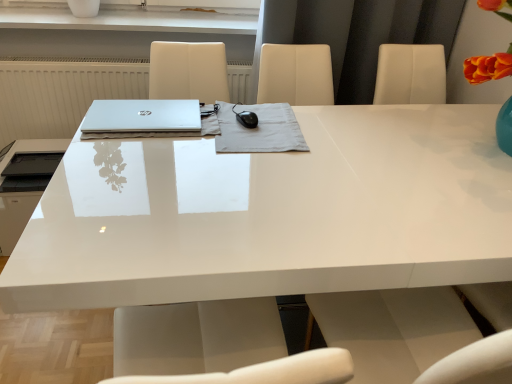
Question: Can you confirm if satin black mouse at center is wider than matte black printer at left?

Choices:
 (A) yes
 (B) no

Answer: (B)

Question: Is the position of satin black mouse at center more distant than that of matte black printer at left?

Choices:
 (A) no
 (B) yes

Answer: (A)

Question: Is satin black mouse at center aimed at matte black printer at left?

Choices:
 (A) no
 (B) yes

Answer: (A)

Question: Is satin black mouse at center closer to the viewer compared to matte black printer at left?

Choices:
 (A) yes
 (B) no

Answer: (A)

Question: Is satin black mouse at center looking in the opposite direction of matte black printer at left?

Choices:
 (A) yes
 (B) no

Answer: (B)

Question: Is satin black mouse at center taller or shorter than matte black printer at left?

Choices:
 (A) short
 (B) tall

Answer: (A)

Question: Do you think satin black mouse at center is within matte black printer at left, or outside of it?

Choices:
 (A) outside
 (B) inside

Answer: (A)

Question: Is point (259, 147) closer or farther from the camera than point (17, 192)?

Choices:
 (A) farther
 (B) closer

Answer: (B)

Question: Would you say satin black mouse at center is to the left or to the right of matte black printer at left in the picture?

Choices:
 (A) right
 (B) left

Answer: (A)

Question: In the image, is satin black mouse at center positioned in front of or behind white glossy vase at upper center?

Choices:
 (A) behind
 (B) front

Answer: (B)

Question: From their relative heights in the image, would you say satin black mouse at center is taller or shorter than white glossy vase at upper center?

Choices:
 (A) tall
 (B) short

Answer: (B)

Question: In terms of size, does satin black mouse at center appear bigger or smaller than white glossy vase at upper center?

Choices:
 (A) small
 (B) big

Answer: (A)

Question: Considering the positions of satin black mouse at center and white glossy vase at upper center in the image, is satin black mouse at center wider or thinner than white glossy vase at upper center?

Choices:
 (A) thin
 (B) wide

Answer: (A)

Question: Is white glossy desk at center to the left or to the right of sleek silver laptop at center in the image?

Choices:
 (A) right
 (B) left

Answer: (A)

Question: From the image's perspective, is white glossy desk at center positioned above or below sleek silver laptop at center?

Choices:
 (A) above
 (B) below

Answer: (B)